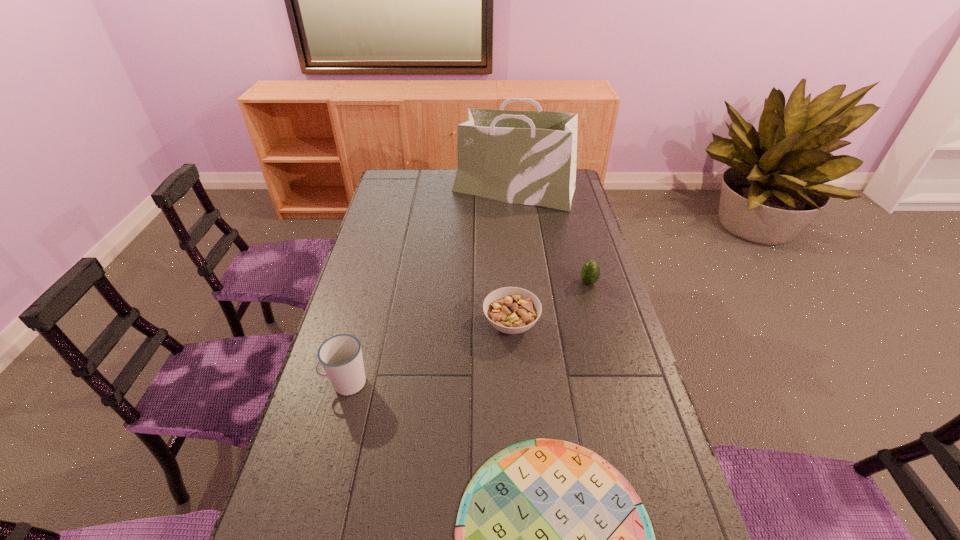
Where is `grocery bag`? The height and width of the screenshot is (540, 960). grocery bag is located at coordinates (523, 157).

Find the location of a particular element. This screenshot has width=960, height=540. the tallest object is located at coordinates (523, 157).

The height and width of the screenshot is (540, 960). What are the coordinates of `cup` in the screenshot? It's located at (340, 356).

Find the location of a particular element. the fourth farthest object is located at coordinates (340, 356).

Identify the location of the fourth nearest object. Image resolution: width=960 pixels, height=540 pixels. (590, 273).

The height and width of the screenshot is (540, 960). I want to click on the third shortest object, so click(590, 273).

Locate an element on the screen. the third nearest object is located at coordinates (511, 310).

The image size is (960, 540). Find the location of `stew`. stew is located at coordinates (511, 310).

Image resolution: width=960 pixels, height=540 pixels. What are the coordinates of `vacant area located 0.080m on the front of the farthest object` in the screenshot? It's located at (517, 222).

Find the location of a particular element. vacant space located on the back of the fourth nearest object is located at coordinates (570, 215).